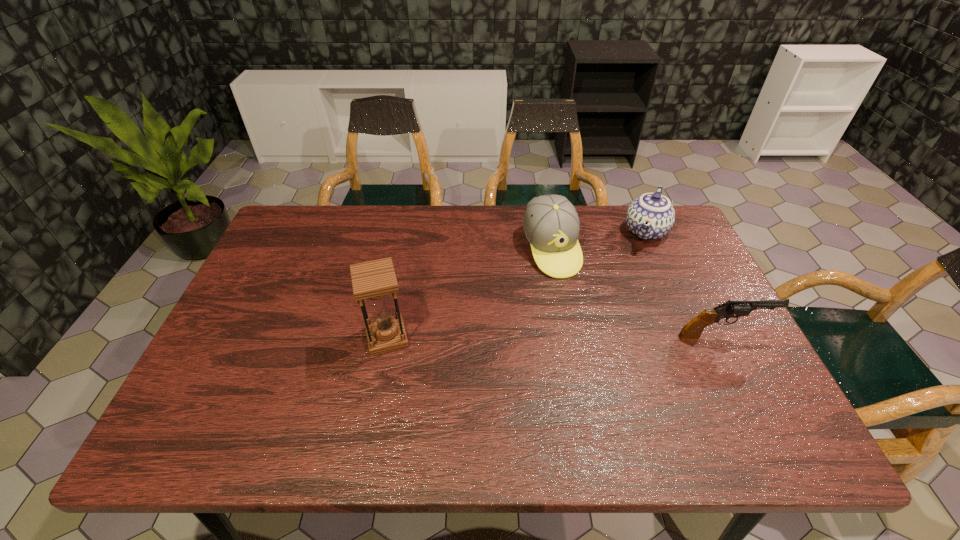
Locate an element on the screen. vacant space on the desktop that is between the hourglass and the gun and is positioned on the front-facing side of the second object from left to right is located at coordinates (588, 337).

Locate an element on the screen. Image resolution: width=960 pixels, height=540 pixels. vacant space on the desktop that is between the leftmost object and the gun and is positioned from the spout of the chinaware is located at coordinates (597, 337).